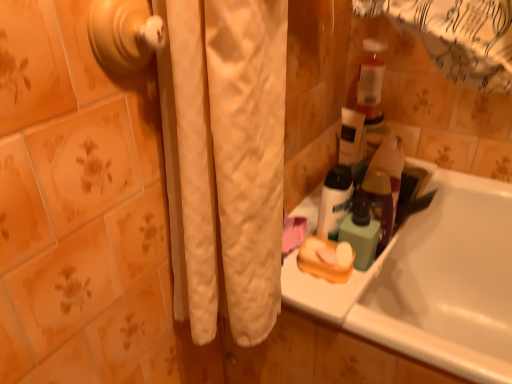
What are the coordinates of `vacant area that is in front of white matte bottle at upper right` in the screenshot? It's located at (343, 301).